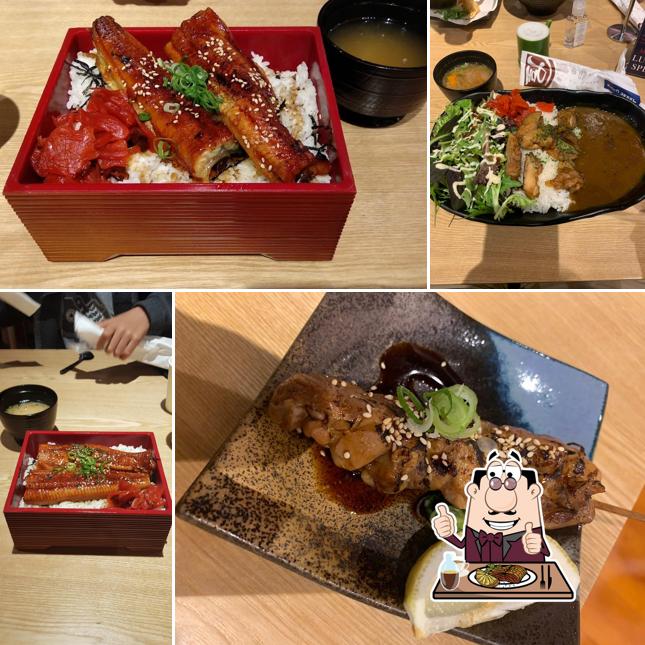
Locate an element on the screen. The height and width of the screenshot is (645, 645). plate is located at coordinates (251, 473).